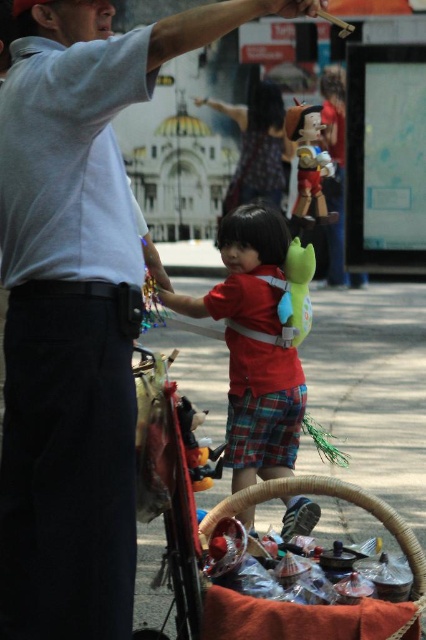
Question: Which object is the closest to the shiny red plastic toy at center?

Choices:
 (A) woven brown basket at lower center
 (B) matte red shirt at center

Answer: (B)

Question: Considering the relative positions of woven brown basket at lower center and shiny red plastic toy at center in the image provided, where is woven brown basket at lower center located with respect to shiny red plastic toy at center?

Choices:
 (A) right
 (B) left

Answer: (B)

Question: Does matte red shirt at center appear under shiny red plastic toy at center?

Choices:
 (A) no
 (B) yes

Answer: (B)

Question: Which point is closer to the camera?

Choices:
 (A) woven brown basket at lower center
 (B) matte red shirt at center

Answer: (A)

Question: Which point is farther from the camera taking this photo?

Choices:
 (A) (311, 109)
 (B) (221, 504)

Answer: (A)

Question: From the image, what is the correct spatial relationship of matte red shirt at center in relation to woven brown basket at lower center?

Choices:
 (A) above
 (B) below

Answer: (A)